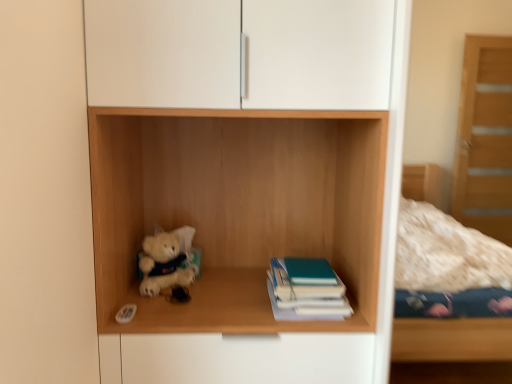
Question: In the image, is wooden shelf at center positioned in front of or behind fluffy white teddy bear at lower left?

Choices:
 (A) front
 (B) behind

Answer: (A)

Question: From the image's perspective, relative to fluffy white teddy bear at lower left, is wooden shelf at center above or below?

Choices:
 (A) below
 (B) above

Answer: (B)

Question: Based on their relative distances, which object is nearer to the teal matte book at center?

Choices:
 (A) wooden shelf at center
 (B) fluffy white teddy bear at lower left

Answer: (A)

Question: Considering the real-world distances, which object is closest to the teal matte book at center?

Choices:
 (A) fluffy white teddy bear at lower left
 (B) wooden shelf at center

Answer: (B)